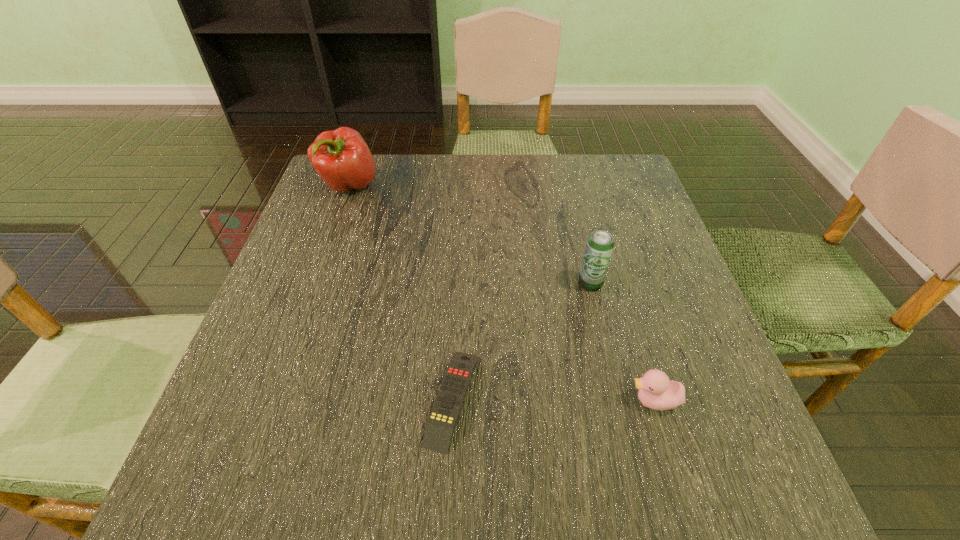
What are the coordinates of `free space located 0.150m on the front-facing side of the duckling` in the screenshot? It's located at (535, 401).

The height and width of the screenshot is (540, 960). Identify the location of free region located 0.060m on the front-facing side of the duckling. (590, 401).

Locate an element on the screen. free space located 0.060m on the left of the shortest object is located at coordinates (389, 399).

At what (x,y) coordinates should I click in order to perform the action: click on object that is at the far edge. Please return your answer as a coordinate pair (x, y). The width and height of the screenshot is (960, 540). Looking at the image, I should click on (341, 157).

You are a GUI agent. You are given a task and a screenshot of the screen. Output one action in this format:
    pyautogui.click(x=<x>, y=<y>)
    Task: Click on the object that is at the near edge
    This screenshot has height=540, width=960.
    Given the screenshot: What is the action you would take?
    pyautogui.click(x=444, y=415)

Find the location of a particular element. The height and width of the screenshot is (540, 960). object that is at the left edge is located at coordinates (341, 157).

Image resolution: width=960 pixels, height=540 pixels. Identify the location of beer can that is at the right edge. (600, 244).

This screenshot has width=960, height=540. What are the coordinates of `duckling present at the right edge` in the screenshot? It's located at (656, 391).

Find the location of a particular element. Image resolution: width=960 pixels, height=540 pixels. object at the far left corner is located at coordinates (341, 157).

Where is `vacant space at the far edge`? vacant space at the far edge is located at coordinates pyautogui.click(x=533, y=168).